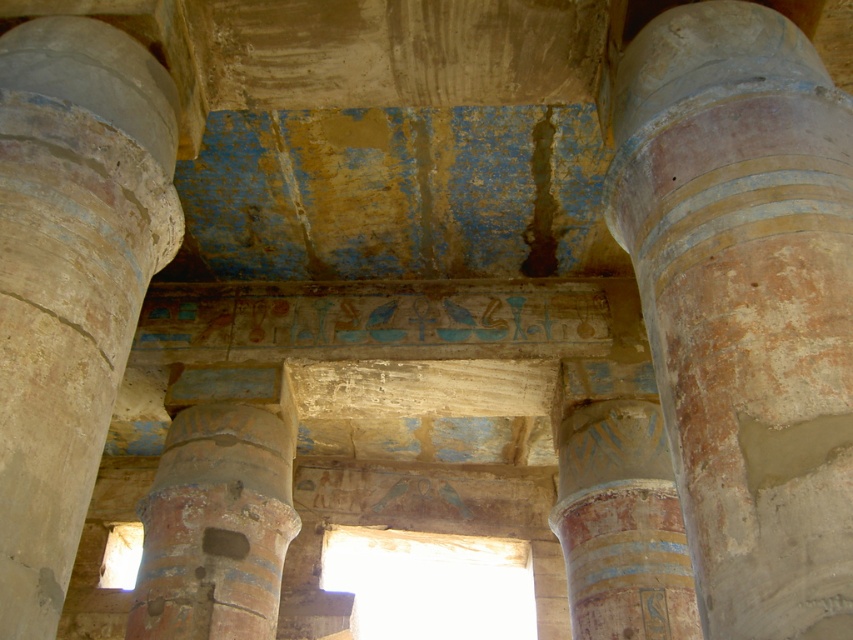
Measure the distance between point (798, 552) and camera.

Point (798, 552) is 2.26 meters away from camera.

Who is lower down, speckled stone column at center or blue painted hieroglyphics at center?

blue painted hieroglyphics at center

Does point (822, 124) come behind point (334, 353)?

No, (822, 124) is closer to viewer.

Identify the location of speckled stone column at center. (746, 304).

What do you see at coordinates (215, 525) in the screenshot?
I see `rusty stone column at center` at bounding box center [215, 525].

Between point (279, 484) and point (552, 328), which one is positioned behind?

The point (552, 328) is more distant.

What are the coordinates of `rusty stone column at center` in the screenshot? It's located at (215, 525).

The image size is (853, 640). What are the coordinates of `rusty stone column at center` in the screenshot? It's located at (215, 525).

What do you see at coordinates (746, 304) in the screenshot? Image resolution: width=853 pixels, height=640 pixels. I see `speckled stone column at center` at bounding box center [746, 304].

Can you confirm if speckled stone column at center is positioned to the right of rusty stone column at center?

Correct, you'll find speckled stone column at center to the right of rusty stone column at center.

Between point (660, 349) and point (141, 508), which one is positioned behind?

The point (141, 508) is behind.

You are a GUI agent. You are given a task and a screenshot of the screen. Output one action in this format:
    pyautogui.click(x=<x>, y=<y>)
    Task: Click on the speckled stone column at center
    The height and width of the screenshot is (640, 853).
    Given the screenshot: What is the action you would take?
    pyautogui.click(x=746, y=304)